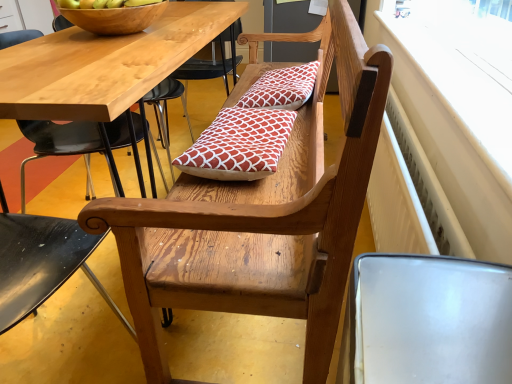
The image size is (512, 384). What do you see at coordinates (112, 15) in the screenshot?
I see `wooden bowl at upper left` at bounding box center [112, 15].

This screenshot has width=512, height=384. Find the location of `wooden chair at left`. wooden chair at left is located at coordinates (37, 260).

Locate an element on the screen. red printed cushion at center, the 1th pillow viewed from the back is located at coordinates (282, 88).

What is the approximate width of red printed cushion at center, the second pillow ordered from the bottom?

It is 12.64 inches.

Locate an element on the screen. The width and height of the screenshot is (512, 384). wooden bench at center is located at coordinates (258, 232).

Measure the distance between wooden bench at center and camera.

The distance of wooden bench at center from camera is 58.82 centimeters.

Find the location of a particular element. This screenshot has width=512, height=384. white plastic radiator at upper right is located at coordinates (463, 73).

Does wooden chair at left have a larger size compared to red printed cushion at center, which is counted as the 2th pillow, starting from the top?

Yes, wooden chair at left is bigger than red printed cushion at center, which is counted as the 2th pillow, starting from the top.

Which is behind, point (127, 126) or point (202, 151)?

The point (127, 126) is farther.

From the image's perspective, who appears lower, wooden chair at left or red printed cushion at center, positioned as the 2th pillow in back-to-front order?

wooden chair at left, from the image's perspective.

Between wooden bench at center and red printed cushion at center, which appears as the first pillow when viewed from the top, which one appears on the right side from the viewer's perspective?

From the viewer's perspective, red printed cushion at center, which appears as the first pillow when viewed from the top, appears more on the right side.

How much distance is there between wooden bench at center and red printed cushion at center, the 1th pillow viewed from the back?

23.88 inches.

Can you tell me how much wooden bench at center and red printed cushion at center, the 1th pillow viewed from the back, differ in facing direction?

The facing directions of wooden bench at center and red printed cushion at center, the 1th pillow viewed from the back, are 4.32 degrees apart.

Is wooden bench at center situated inside red printed cushion at center, the second pillow ordered from the bottom, or outside?

wooden bench at center is not inside red printed cushion at center, the second pillow ordered from the bottom, it's outside.

Which object is further away from the camera taking this photo, red printed cushion at center, positioned as the 2th pillow in front-to-back order, or white plastic radiator at upper right?

red printed cushion at center, positioned as the 2th pillow in front-to-back order, is further away from the camera.

Is red printed cushion at center, which appears as the first pillow when viewed from the top, looking in the opposite direction of white plastic radiator at upper right?

No, red printed cushion at center, which appears as the first pillow when viewed from the top,'s orientation is not away from white plastic radiator at upper right.

Can we say red printed cushion at center, which appears as the first pillow when viewed from the top, lies outside white plastic radiator at upper right?

Yes, red printed cushion at center, which appears as the first pillow when viewed from the top, is not within white plastic radiator at upper right.

Between red printed cushion at center, the 1th pillow viewed from the back, and white plastic radiator at upper right, which one has more height?

With more height is red printed cushion at center, the 1th pillow viewed from the back.

Considering the relative positions of red printed cushion at center, positioned as the 2th pillow in front-to-back order, and red printed cushion at center, which is the 1th pillow from front to back, in the image provided, is red printed cushion at center, positioned as the 2th pillow in front-to-back order, to the left or to the right of red printed cushion at center, which is the 1th pillow from front to back,?

red printed cushion at center, positioned as the 2th pillow in front-to-back order, is to the right of red printed cushion at center, which is the 1th pillow from front to back.

Between red printed cushion at center, the 1th pillow viewed from the back, and red printed cushion at center, positioned as the 2th pillow in back-to-front order, which one has larger width?

Wider between the two is red printed cushion at center, the 1th pillow viewed from the back.

From a real-world perspective, which object rests below the other?

red printed cushion at center, which is the 1th pillow from front to back.

Are red printed cushion at center, the 1th pillow viewed from the back, and wooden chair at left located far from each other?

Absolutely, red printed cushion at center, the 1th pillow viewed from the back, is distant from wooden chair at left.

Looking at this image, is red printed cushion at center, which appears as the first pillow when viewed from the top, closer to the viewer compared to wooden chair at left?

That is False.

Does red printed cushion at center, the second pillow ordered from the bottom, have a larger size compared to wooden chair at left?

Actually, red printed cushion at center, the second pillow ordered from the bottom, might be smaller than wooden chair at left.

Locate an element on the screen. The image size is (512, 384). the 2nd pillow positioned above the wooden chair at left (from a real-world perspective) is located at coordinates (282, 88).

From the picture: From a real-world perspective, who is located higher, wooden bowl at upper left or red printed cushion at center, positioned as the 2th pillow in back-to-front order?

From a 3D spatial view, wooden bowl at upper left is above.

Are wooden bowl at upper left and red printed cushion at center, which is counted as the 2th pillow, starting from the top, beside each other?

No, wooden bowl at upper left is not making contact with red printed cushion at center, which is counted as the 2th pillow, starting from the top.

From the wooden bowl at upper left, count 1st pillow to the right and point to it. Please provide its 2D coordinates.

[(239, 145)]

Does wooden bowl at upper left have a lesser width compared to red printed cushion at center, which is counted as the 2th pillow, starting from the top?

No.

Considering the relative sizes of wooden bowl at upper left and white plastic radiator at upper right in the image provided, is wooden bowl at upper left bigger than white plastic radiator at upper right?

Actually, wooden bowl at upper left might be smaller than white plastic radiator at upper right.

What are the coordinates of `bowl above the white plastic radiator at upper right (from the image's perspective)` in the screenshot? It's located at (112, 15).

At what (x,y) coordinates should I click in order to perform the action: click on chair below the red printed cushion at center, which appears as the first pillow when ordered from the bottom (from a real-world perspective). Please return your answer as a coordinate pair (x, y). Looking at the image, I should click on (37, 260).

Which pillow is the 2nd one when counting from the back of the wooden bench at center? Please provide its 2D coordinates.

[(282, 88)]

Which object lies further to the anchor point wooden bowl at upper left, wooden chair at left or red printed cushion at center, positioned as the 2th pillow in front-to-back order?

wooden chair at left lies further to wooden bowl at upper left than the other object.

Estimate the real-world distances between objects in this image. Which object is further from red printed cushion at center, which is counted as the 2th pillow, starting from the top, wooden bowl at upper left or red printed cushion at center, the second pillow ordered from the bottom?

Based on the image, wooden bowl at upper left appears to be further to red printed cushion at center, which is counted as the 2th pillow, starting from the top.

Estimate the real-world distances between objects in this image. Which object is closer to wooden bench at center, wooden bowl at upper left or red printed cushion at center, positioned as the 2th pillow in back-to-front order?

Among the two, red printed cushion at center, positioned as the 2th pillow in back-to-front order, is located nearer to wooden bench at center.

Looking at the image, which one is located closer to wooden chair at left, wooden bowl at upper left or red printed cushion at center, which is the 1th pillow from front to back?

Among the two, wooden bowl at upper left is located nearer to wooden chair at left.

From the image, which object appears to be farther from wooden chair at left, red printed cushion at center, the 1th pillow viewed from the back, or wooden bowl at upper left?

red printed cushion at center, the 1th pillow viewed from the back, is positioned further to the anchor wooden chair at left.

Based on their spatial positions, is wooden bench at center or wooden chair at left further from wooden bowl at upper left?

wooden chair at left is positioned further to the anchor wooden bowl at upper left.

Looking at the image, which one is located closer to red printed cushion at center, which is counted as the 2th pillow, starting from the top, white plastic radiator at upper right or wooden bench at center?

wooden bench at center lies closer to red printed cushion at center, which is counted as the 2th pillow, starting from the top, than the other object.

Considering their positions, is red printed cushion at center, the second pillow ordered from the bottom, positioned further to wooden chair at left than red printed cushion at center, which appears as the first pillow when ordered from the bottom?

red printed cushion at center, which appears as the first pillow when ordered from the bottom, is positioned further to the anchor wooden chair at left.

Identify the location of bench between wooden bowl at upper left and white plastic radiator at upper right from left to right. The height and width of the screenshot is (384, 512). (258, 232).

This screenshot has width=512, height=384. I want to click on window frame positioned between wooden chair at left and red printed cushion at center, the 1th pillow viewed from the back, from near to far, so click(x=463, y=73).

Identify the location of bowl between wooden bench at center and red printed cushion at center, the second pillow ordered from the bottom, from front to back. Image resolution: width=512 pixels, height=384 pixels. (112, 15).

Identify the location of bench positioned between wooden chair at left and red printed cushion at center, the second pillow ordered from the bottom, from near to far. (258, 232).